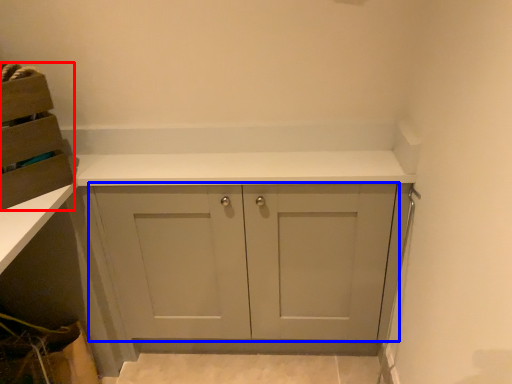
Question: Among these objects, which one is nearest to the camera, cabinetry (highlighted by a red box) or cabinetry (highlighted by a blue box)?

Choices:
 (A) cabinetry
 (B) cabinetry

Answer: (A)